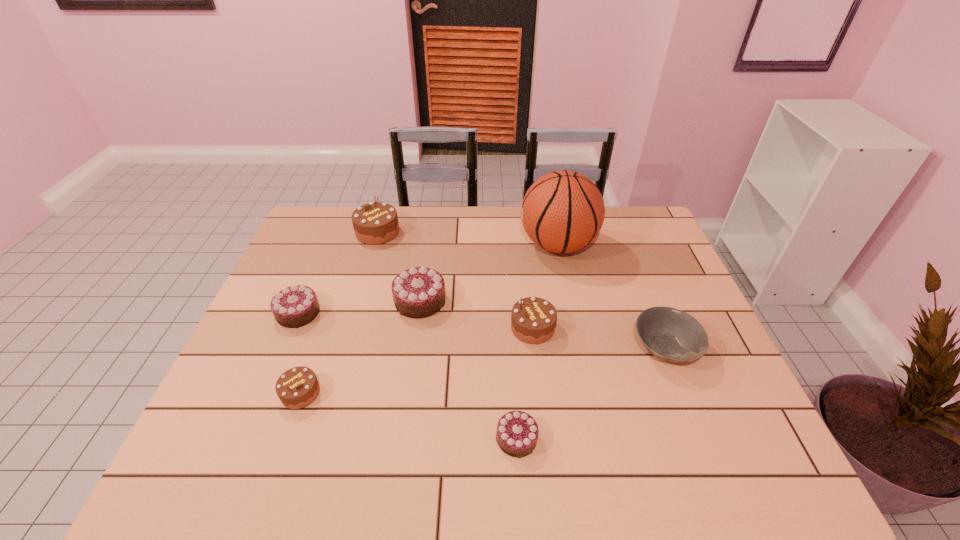
Locate an element on the screen. The width and height of the screenshot is (960, 540). basketball is located at coordinates (563, 211).

Locate an element on the screen. This screenshot has width=960, height=540. the tallest object is located at coordinates (563, 211).

Image resolution: width=960 pixels, height=540 pixels. Identify the location of the biggest brown chocolate cake. (374, 223).

At what (x,y) coordinates should I click in order to perform the action: click on the second tallest object. Please return your answer as a coordinate pair (x, y). Image resolution: width=960 pixels, height=540 pixels. Looking at the image, I should click on (374, 223).

The image size is (960, 540). I want to click on the third chocolate cake from right to left, so click(x=419, y=292).

The width and height of the screenshot is (960, 540). I want to click on the biggest chocolate chocolate cake, so click(x=419, y=292).

Locate an element on the screen. Image resolution: width=960 pixels, height=540 pixels. the rightmost brown chocolate cake is located at coordinates (533, 319).

Identify the location of the second farthest brown chocolate cake. The height and width of the screenshot is (540, 960). (533, 319).

Where is `the leftmost chocolate chocolate cake`? the leftmost chocolate chocolate cake is located at coordinates (295, 306).

You are a GUI agent. You are given a task and a screenshot of the screen. Output one action in this format:
    pyautogui.click(x=<x>, y=<y>)
    Task: Click on the nearest brown chocolate cake
    
    Given the screenshot: What is the action you would take?
    pyautogui.click(x=298, y=387)